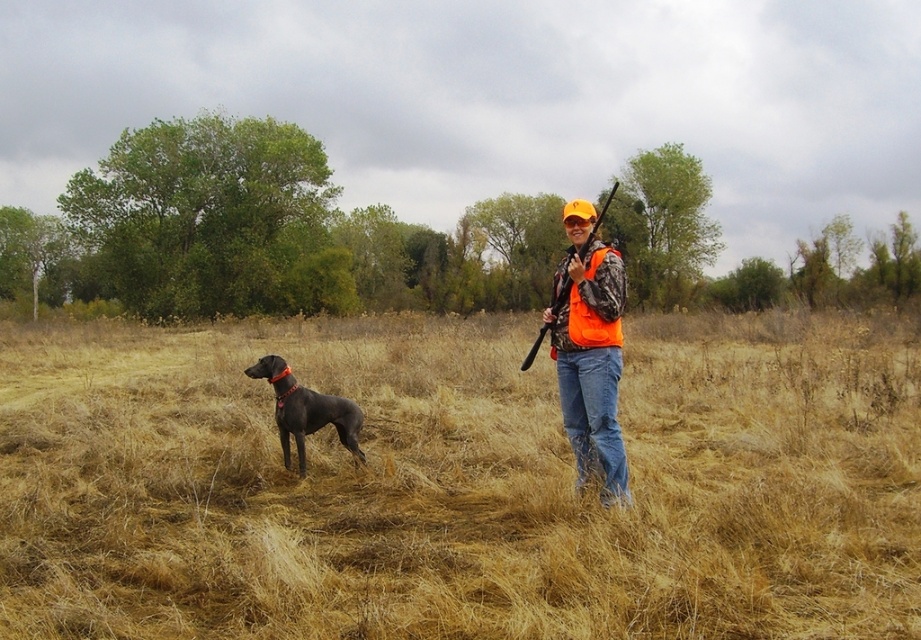
Question: Which point is closer to the camera?

Choices:
 (A) (575, 216)
 (B) (350, 417)

Answer: (A)

Question: Which object is positioned closest to the orange camo vest at center?

Choices:
 (A) dry grass at center
 (B) orange matte safety goggles at upper center
 (C) matte black rifle at center

Answer: (B)

Question: Does orange camo vest at center have a lesser width compared to matte black rifle at center?

Choices:
 (A) yes
 (B) no

Answer: (A)

Question: Does dry grass at center appear under orange matte safety goggles at upper center?

Choices:
 (A) yes
 (B) no

Answer: (A)

Question: Which object appears closest to the camera in this image?

Choices:
 (A) orange camo vest at center
 (B) matte black rifle at center
 (C) dry grass at center
 (D) orange matte safety goggles at upper center

Answer: (C)

Question: Is shiny black dog at center further to the viewer compared to orange matte safety goggles at upper center?

Choices:
 (A) yes
 (B) no

Answer: (A)